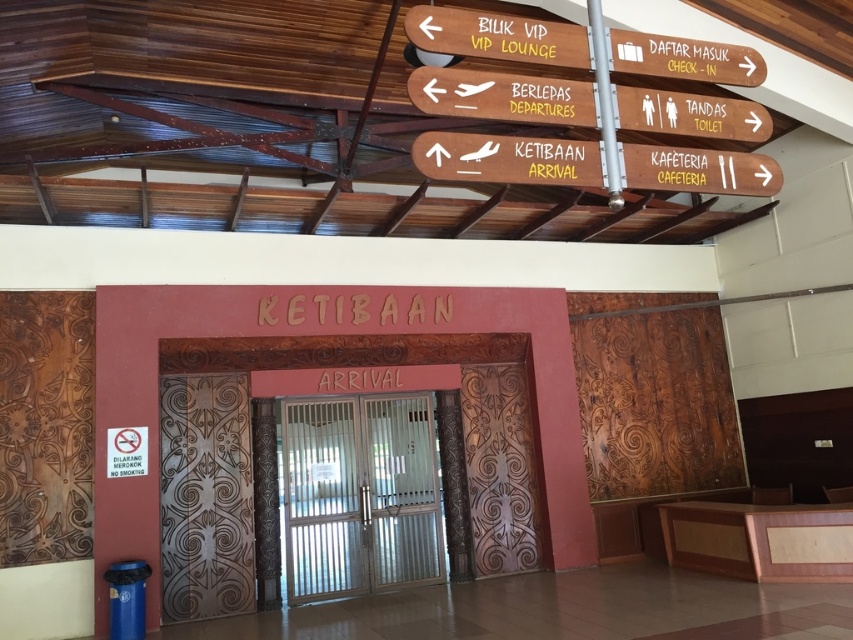
Between white plastic sign at center and yellow painted wooden sign at upper center, which one is positioned higher?

Positioned higher is yellow painted wooden sign at upper center.

The image size is (853, 640). In order to click on white plastic sign at center in this screenshot , I will do `click(508, 160)`.

Where is `white plastic sign at center`? This screenshot has width=853, height=640. white plastic sign at center is located at coordinates (508, 160).

Which of these two, wooden sign at center or yellow painted wooden sign at upper center, stands shorter?

Standing shorter between the two is wooden sign at center.

Between point (488, 74) and point (486, 44), which one is positioned behind?

The point (488, 74) is behind.

Identify the location of wooden sign at center. The image size is (853, 640). (503, 97).

Does white metal elevator at center lie behind white plastic sign at center?

Yes, it is.

In order to click on white metal elevator at center in this screenshot , I will do `click(358, 496)`.